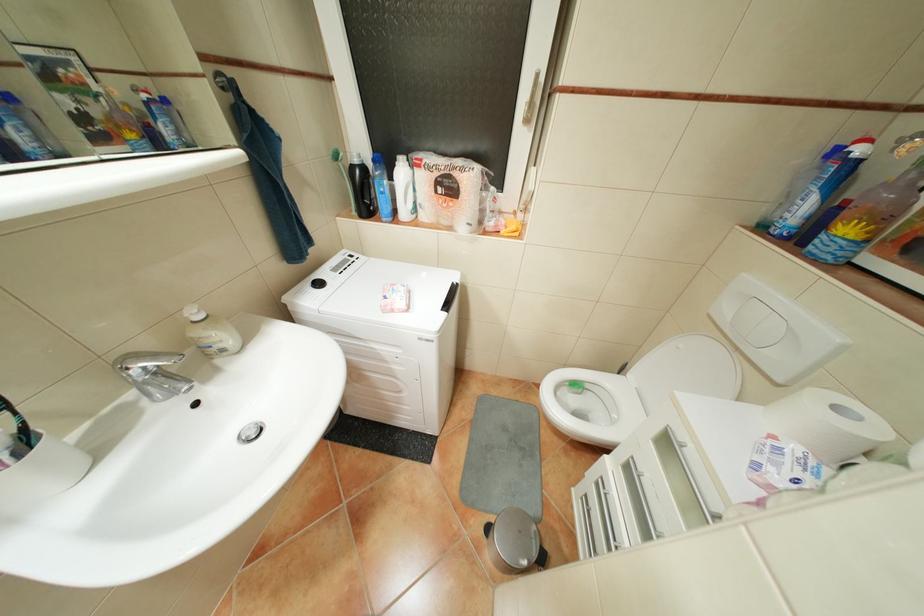
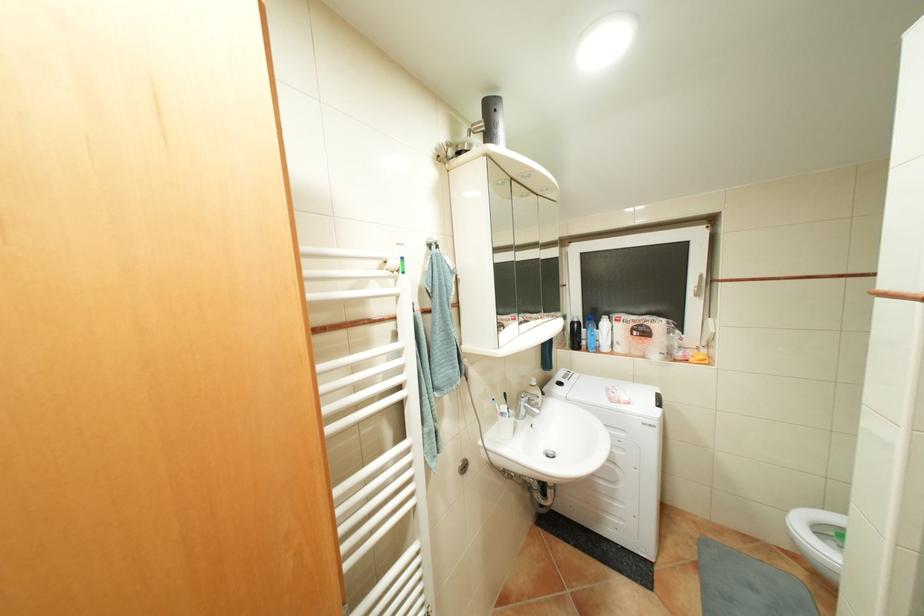
Find the pixel in the second image that matches point (329, 283) in the first image.

(569, 383)